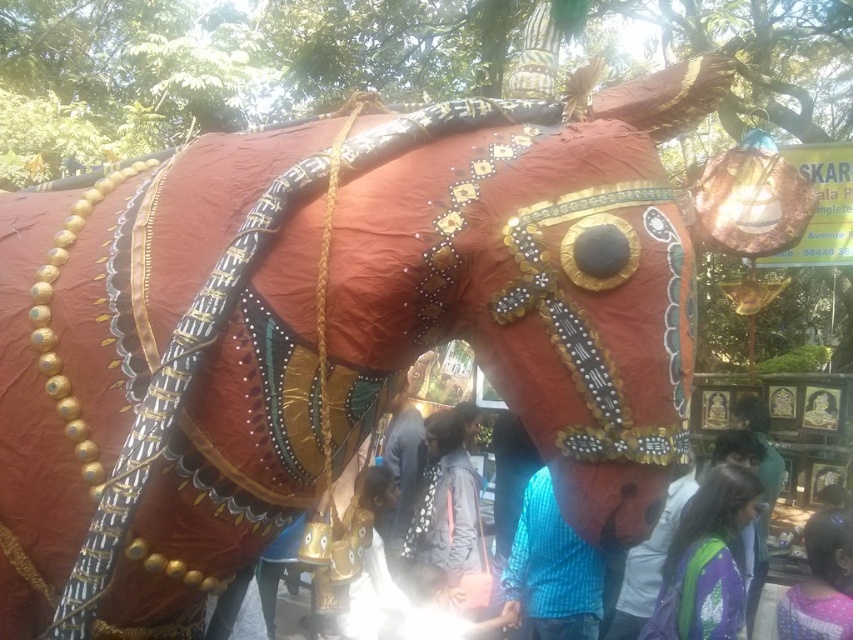
Question: Which is nearer to the purple fabric at center?

Choices:
 (A) blue checkered shirt at center
 (B) purple fabric at lower right

Answer: (B)

Question: Is purple fabric at center further to camera compared to purple fabric at lower right?

Choices:
 (A) yes
 (B) no

Answer: (A)

Question: Does blue checkered shirt at center have a greater width compared to purple fabric at lower right?

Choices:
 (A) no
 (B) yes

Answer: (B)

Question: Which of these objects is positioned closest to the blue checkered shirt at center?

Choices:
 (A) purple fabric at lower right
 (B) purple fabric at center

Answer: (B)

Question: Can you confirm if purple fabric at center is thinner than blue checkered shirt at center?

Choices:
 (A) yes
 (B) no

Answer: (B)

Question: Which object is the closest to the purple fabric at center?

Choices:
 (A) blue checkered shirt at center
 (B) purple fabric at lower right

Answer: (B)